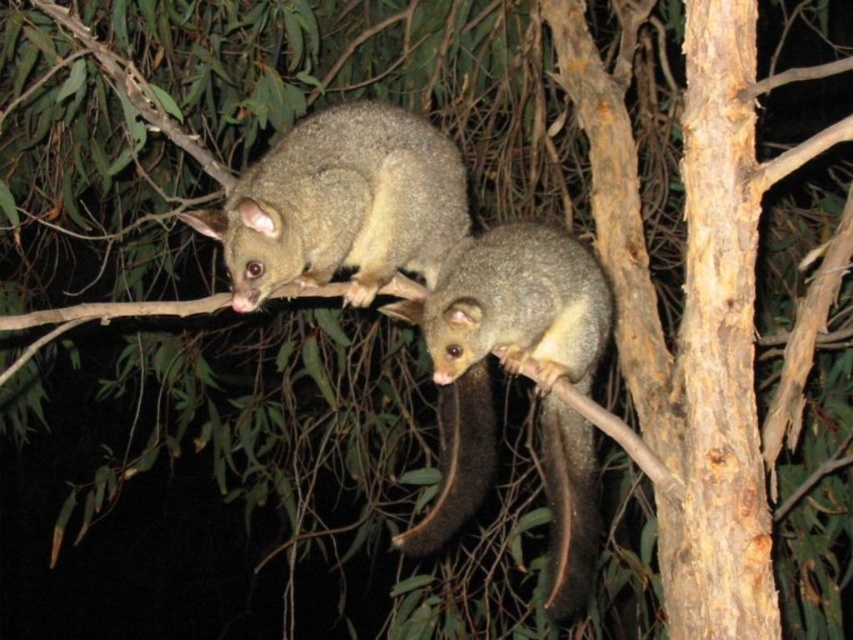
Is fuzzy gray possum at upper center wider than brown furry tail at lower center?

Correct, the width of fuzzy gray possum at upper center exceeds that of brown furry tail at lower center.

How distant is fuzzy gray possum at upper center from brown furry tail at lower center?

The distance of fuzzy gray possum at upper center from brown furry tail at lower center is 64.61 centimeters.

At what (x,y) coordinates should I click in order to perform the action: click on fuzzy gray possum at upper center. Please return your answer as a coordinate pair (x, y). Looking at the image, I should click on (341, 205).